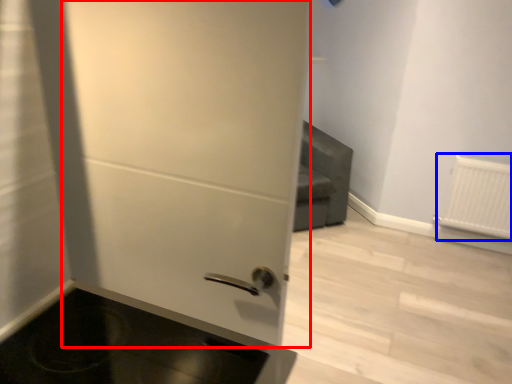
Question: Which of the following is the farthest to the observer, door (highlighted by a red box) or radiator (highlighted by a blue box)?

Choices:
 (A) door
 (B) radiator

Answer: (B)